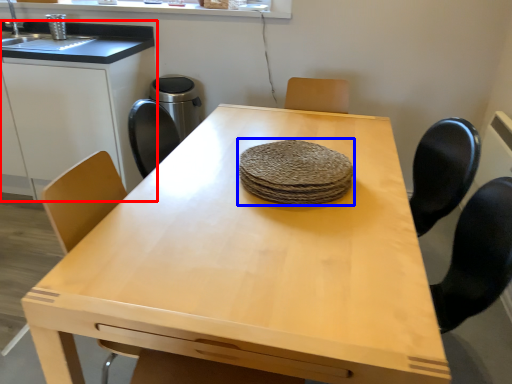
Question: Which of the following is the closest to the observer, cabinetry (highlighted by a red box) or food (highlighted by a blue box)?

Choices:
 (A) cabinetry
 (B) food

Answer: (B)